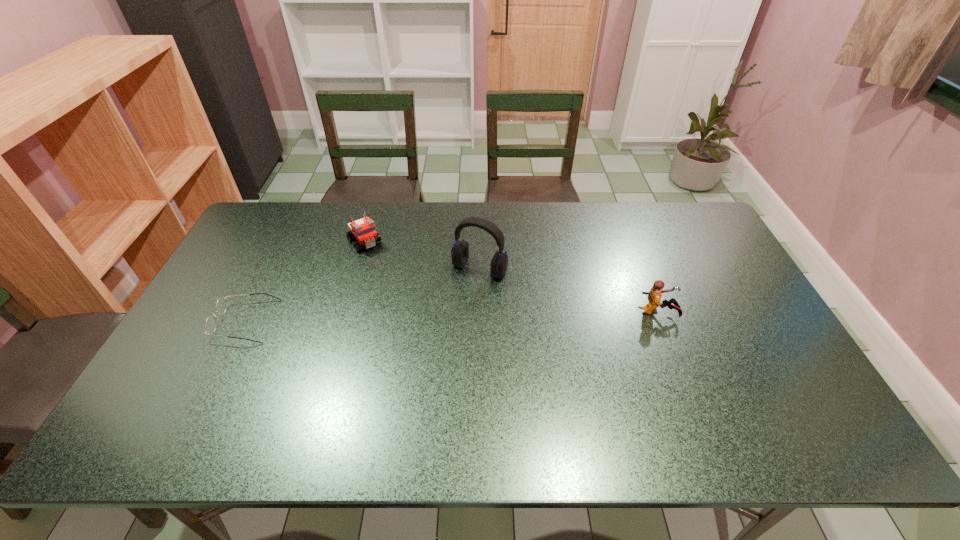
Locate an element on the screen. This screenshot has height=540, width=960. vacant area that lies between the right Lego and the leftmost object is located at coordinates (453, 316).

Locate an element on the screen. This screenshot has width=960, height=540. the closest object relative to the nearer Lego is located at coordinates point(460,251).

Locate an element on the screen. The height and width of the screenshot is (540, 960). object that can be found as the closest to the headset is located at coordinates (364, 229).

Locate an element on the screen. This screenshot has width=960, height=540. free location that satisfies the following two spatial constraints: 1. on the front side of the rightmost object; 2. holding a crossbow in the hands of the left Lego is located at coordinates [344, 312].

I want to click on free point that satisfies the following two spatial constraints: 1. on the front side of the headset; 2. holding a crossbow in the hands of the rightmost object, so click(479, 312).